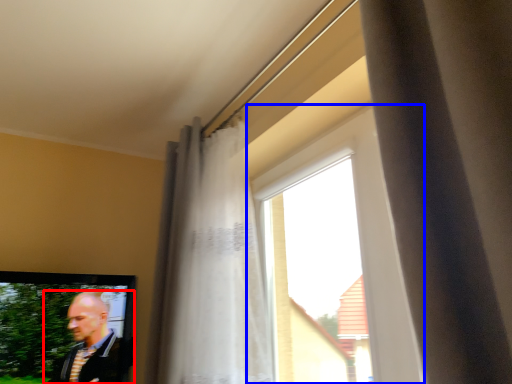
Question: Which of the following is the closest to the observer, man (highlighted by a red box) or window (highlighted by a blue box)?

Choices:
 (A) man
 (B) window

Answer: (B)